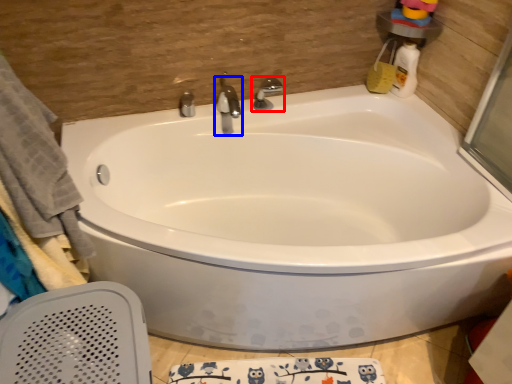
Question: Which object is closer to the camera taking this photo, tap (highlighted by a red box) or tap (highlighted by a blue box)?

Choices:
 (A) tap
 (B) tap

Answer: (B)